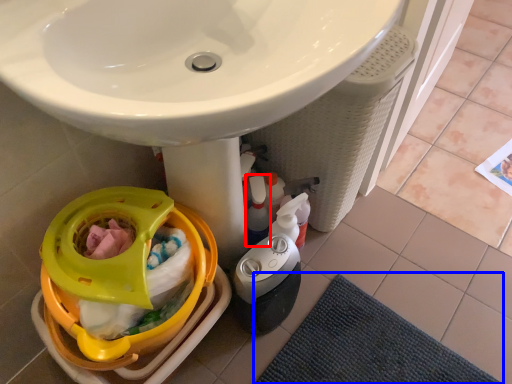
Question: Which object appears farthest to the camera in this image, cleaning product (highlighted by a red box) or bath mat (highlighted by a blue box)?

Choices:
 (A) cleaning product
 (B) bath mat

Answer: (A)